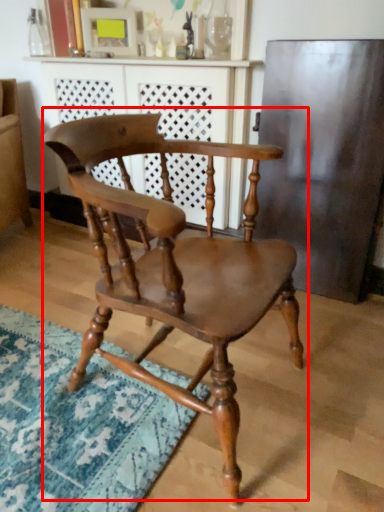
Question: Where is chair (annotated by the red box) located in relation to dresser in the image?

Choices:
 (A) left
 (B) right

Answer: (B)